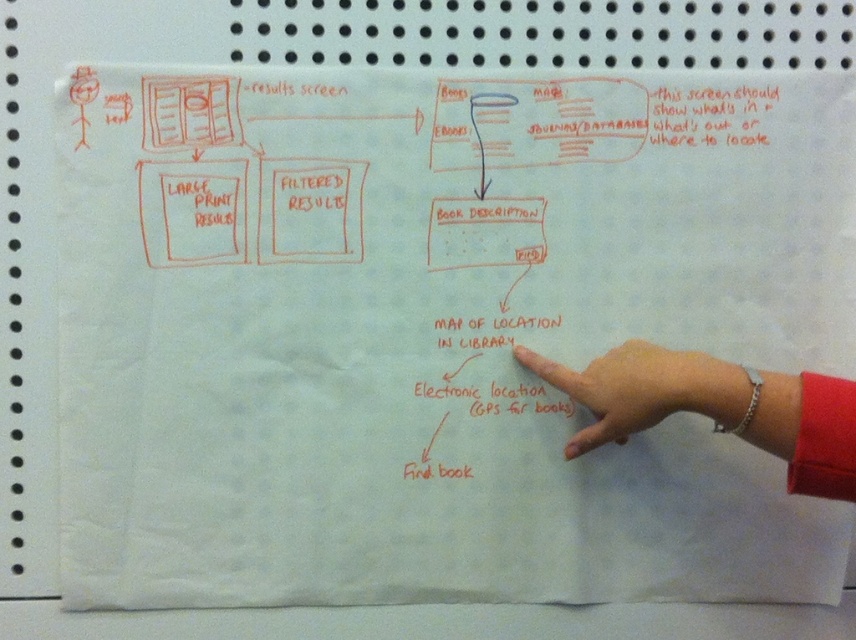
Question: Is silver bracelet at lower right above white skin at center?

Choices:
 (A) yes
 (B) no

Answer: (B)

Question: Among these objects, which one is farthest from the camera?

Choices:
 (A) white skin at center
 (B) silver bracelet at lower right

Answer: (A)

Question: Estimate the real-world distances between objects in this image. Which object is farther from the silver bracelet at lower right?

Choices:
 (A) matte red book description at center
 (B) white skin at center

Answer: (A)

Question: Where is silver bracelet at lower right located in relation to matte red book description at center in the image?

Choices:
 (A) left
 (B) right

Answer: (B)

Question: Considering the real-world distances, which object is farthest from the white skin at center?

Choices:
 (A) silver bracelet at lower right
 (B) matte red book description at center

Answer: (B)

Question: Can you confirm if silver bracelet at lower right is smaller than white skin at center?

Choices:
 (A) yes
 (B) no

Answer: (B)